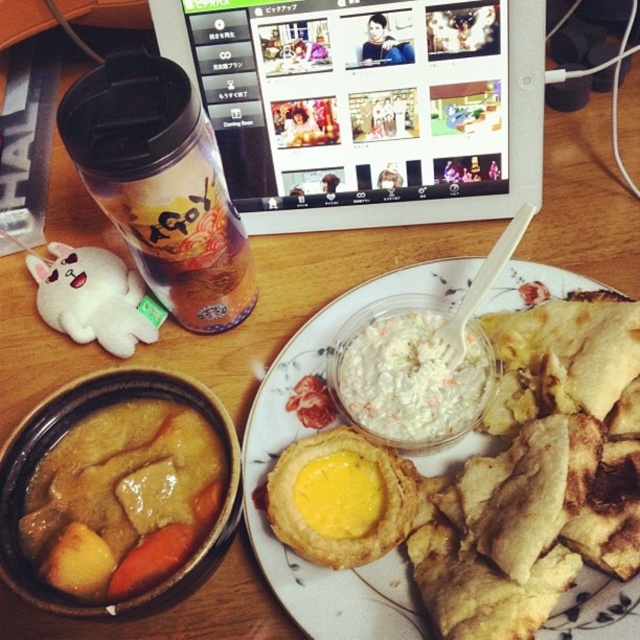
You are a delivery robot with a 24 inch wide package. You need to navigate between the two points marked as point (512, 168) and the other point. Can you fit through the space between them?

→ The distance between the two points is 27.77 inches, so the robot can fit through the space since the package is 24 inches wide and the space is wider than the package.

Consider the image. You are a chef trying to balance two dishes on a tray. You have the golden brown curry at plate center and the yellow fried egg at center. Which dish has a larger width to help stabilize the tray?

The golden brown curry at plate center has a larger width than the yellow fried egg at center, so it would help stabilize the tray better.

You are a delivery robot trying to navigate to the curry dish located at point (337, 564). There is an obstacle at point (445, 115). Can you safely move around the obstacle to reach your destination?

Point (445, 115) is closer to you than point (337, 564), so you must navigate around the obstacle first before proceeding to the curry dish at (337, 564).